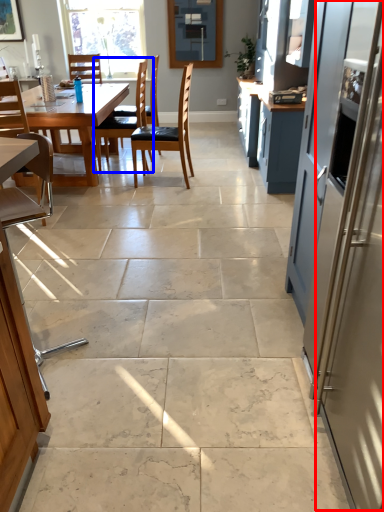
Question: Which object is further to the camera taking this photo, screen door (highlighted by a red box) or chair (highlighted by a blue box)?

Choices:
 (A) screen door
 (B) chair

Answer: (B)